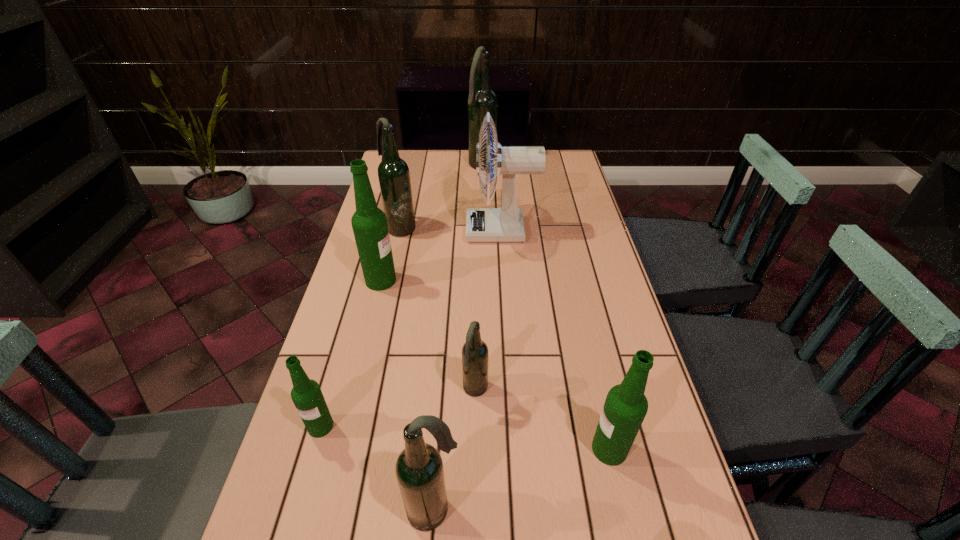
Locate an element on the screen. The image size is (960, 540). the farthest beer bottle is located at coordinates (482, 99).

You are a GUI agent. You are given a task and a screenshot of the screen. Output one action in this format:
    pyautogui.click(x=<x>, y=<y>)
    Task: Click on the farthest dark beer bottle
    This screenshot has height=540, width=960.
    Given the screenshot: What is the action you would take?
    pyautogui.click(x=482, y=99)

Locate an element on the screen. blue fan is located at coordinates (506, 224).

Find the location of a particular element. The height and width of the screenshot is (540, 960). the fifth nearest object is located at coordinates (369, 223).

I want to click on the fifth nearest beer bottle, so click(369, 223).

The image size is (960, 540). What are the coordinates of `the leftmost dark beer bottle` in the screenshot? It's located at (x=394, y=177).

Identify the location of the second biggest dark beer bottle. The width and height of the screenshot is (960, 540). (394, 177).

The image size is (960, 540). I want to click on the rightmost green beer bottle, so click(625, 407).

The height and width of the screenshot is (540, 960). Identify the location of the second biggest green beer bottle. (x=625, y=407).

Identify the location of the nearest object. (419, 469).